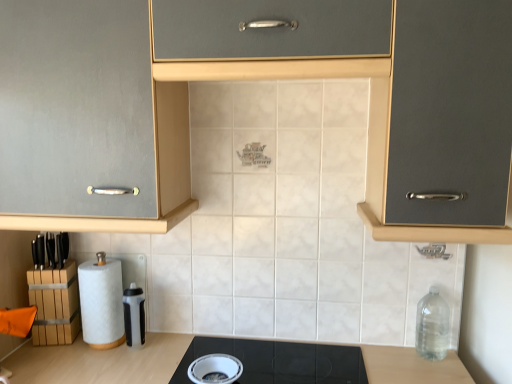
The width and height of the screenshot is (512, 384). Find the location of `free spot behind white glossy bowl at lower center, marked as the second appliance in a left-to-right arrangement`. free spot behind white glossy bowl at lower center, marked as the second appliance in a left-to-right arrangement is located at coordinates (227, 350).